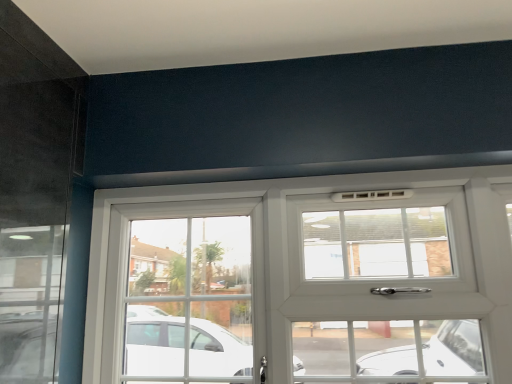
Describe the element at coordinates (303, 258) in the screenshot. I see `white plastic window at center` at that location.

Locate an element on the screen. The image size is (512, 384). white plastic window at center is located at coordinates (303, 258).

At what (x,y) coordinates should I click in order to perform the action: click on white plastic window at center. Please return your answer as a coordinate pair (x, y). Image resolution: width=512 pixels, height=384 pixels. Looking at the image, I should click on (303, 258).